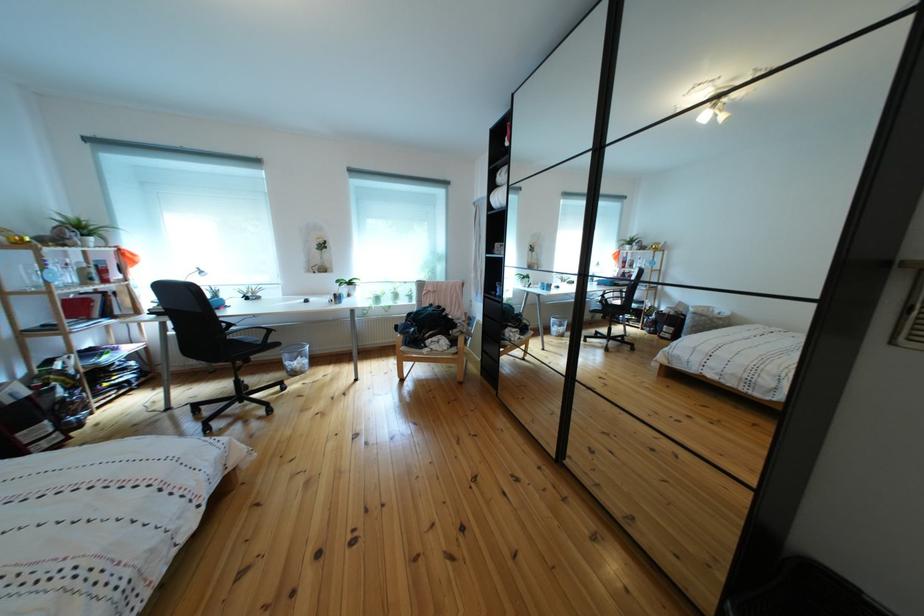
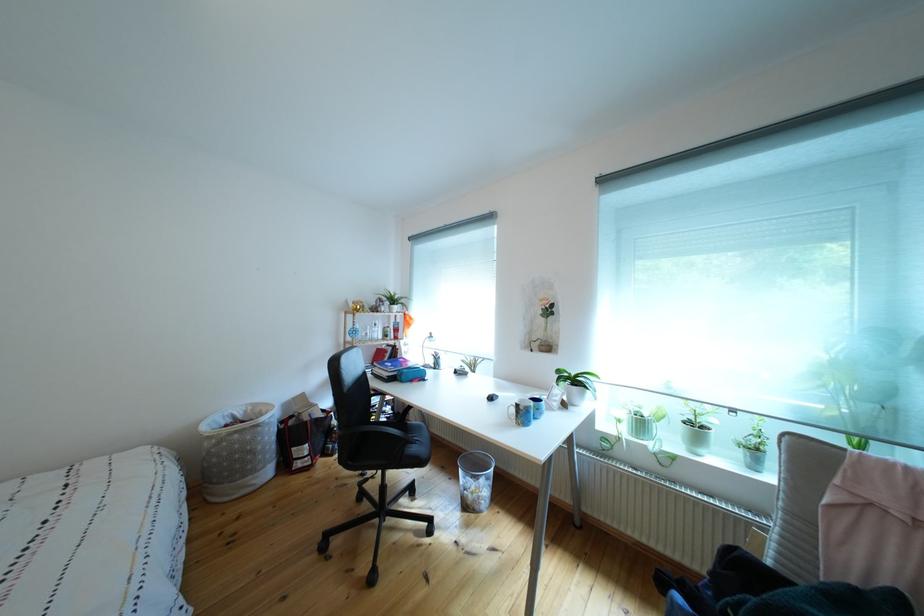
Find the pixel in the second image that matches point (361, 289) in the first image.

(588, 387)